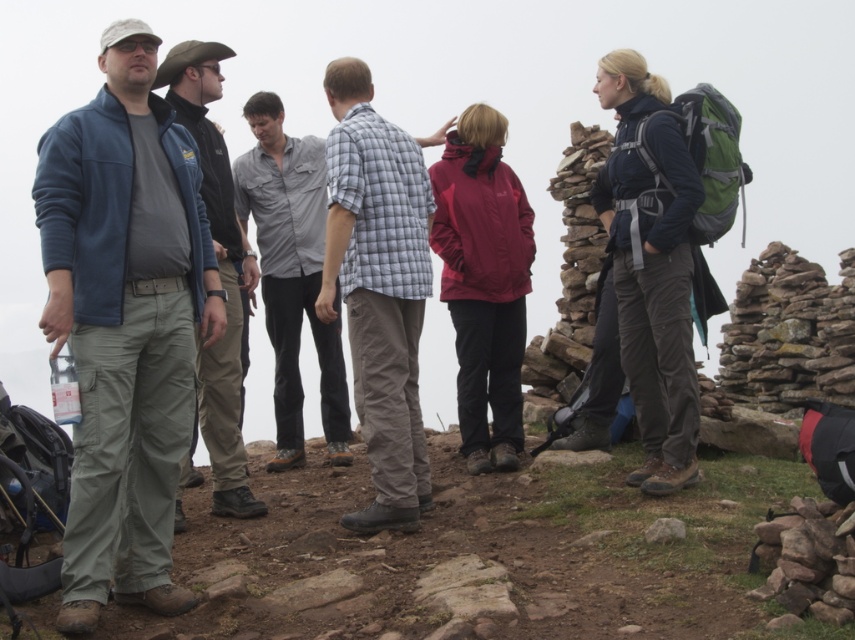
Between point (96, 436) and point (316, 236), which one is positioned in front?

Point (96, 436)

Does matte blue jacket at left have a lesser width compared to gray cotton shirt at center?

Indeed, matte blue jacket at left has a lesser width compared to gray cotton shirt at center.

Between point (151, 445) and point (315, 156), which one is positioned behind?

Point (315, 156)

Where is `matte blue jacket at left`? matte blue jacket at left is located at coordinates (125, 323).

Who is positioned more to the right, matte blue jacket at left or dark blue fabric jacket at right?

From the viewer's perspective, dark blue fabric jacket at right appears more on the right side.

Can you confirm if matte blue jacket at left is taller than dark blue fabric jacket at right?

Correct, matte blue jacket at left is much taller as dark blue fabric jacket at right.

Which is in front, point (154, 212) or point (688, 308)?

Point (154, 212) is in front.

Locate an element on the screen. matte blue jacket at left is located at coordinates (125, 323).

Between plaid cotton shirt at center and brushed metal jacket at left, which one has less height?

With less height is plaid cotton shirt at center.

Is plaid cotton shirt at center thinner than brushed metal jacket at left?

Indeed, plaid cotton shirt at center has a lesser width compared to brushed metal jacket at left.

Where is `plaid cotton shirt at center`? The image size is (855, 640). plaid cotton shirt at center is located at coordinates (378, 289).

Find the location of a particular element. plaid cotton shirt at center is located at coordinates (378, 289).